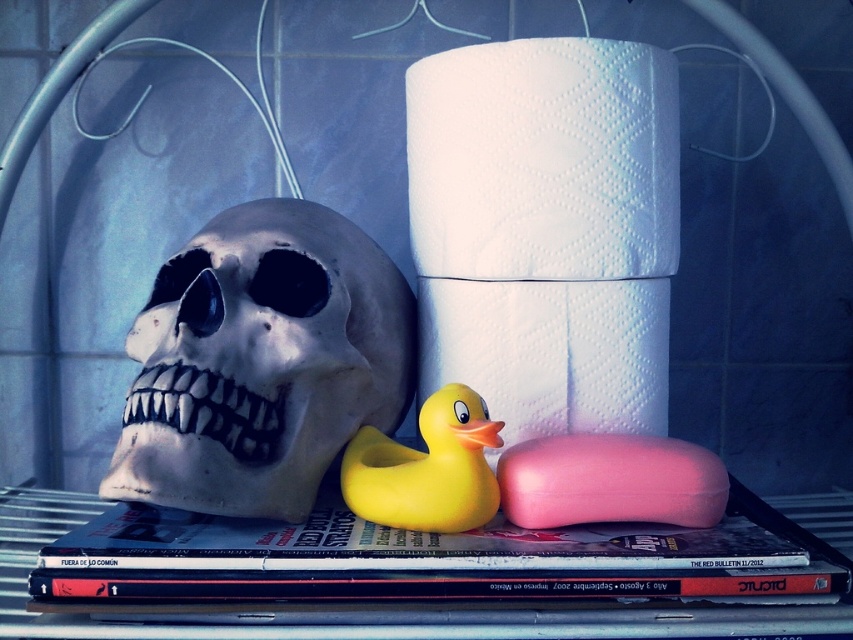
Question: Among these points, which one is farthest from the camera?

Choices:
 (A) (502, 284)
 (B) (428, 444)
 (C) (746, 502)
 (D) (136, 467)

Answer: (C)

Question: Can you confirm if white paper towel at center is positioned below pink matte soap at center?

Choices:
 (A) yes
 (B) no

Answer: (B)

Question: Which point appears farthest from the camera in this image?

Choices:
 (A) (112, 456)
 (B) (500, 500)

Answer: (A)

Question: Where is white matte skull at left located in relation to pink matte soap at center in the image?

Choices:
 (A) left
 (B) right

Answer: (A)

Question: Is white paper towel at center to the right of pink matte soap at center from the viewer's perspective?

Choices:
 (A) no
 (B) yes

Answer: (A)

Question: Which object is closer to the camera taking this photo?

Choices:
 (A) yellow rubber duck at center
 (B) white paper towel at center

Answer: (A)